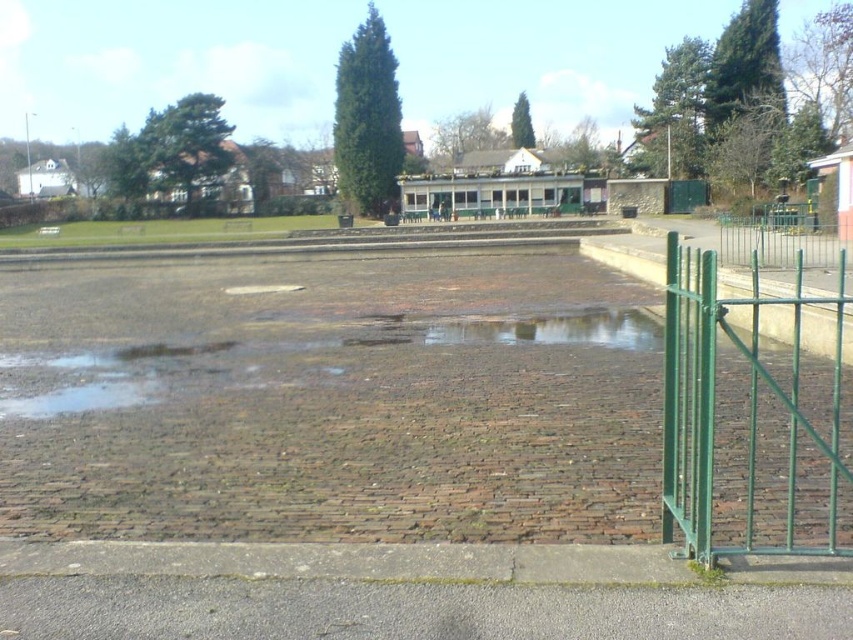
Consider the image. Does green painted metal gate at right have a larger size compared to green metal fence at right?

No, green painted metal gate at right is not bigger than green metal fence at right.

You are a GUI agent. You are given a task and a screenshot of the screen. Output one action in this format:
    pyautogui.click(x=<x>, y=<y>)
    Task: Click on the green painted metal gate at right
    This screenshot has height=640, width=853.
    Given the screenshot: What is the action you would take?
    pyautogui.click(x=747, y=412)

Between point (747, 497) and point (817, 243), which one is positioned in front?

Point (747, 497)

At what (x,y) coordinates should I click in order to perform the action: click on green painted metal gate at right. Please return your answer as a coordinate pair (x, y). This screenshot has width=853, height=640. Looking at the image, I should click on (747, 412).

Which is above, green painted metal gate at right or shiny brown puddle at center?

green painted metal gate at right is higher up.

Does point (693, 417) lie behind point (515, 330)?

No, it is not.

Does point (695, 404) come closer to viewer compared to point (627, 330)?

Yes, point (695, 404) is in front of point (627, 330).

Locate an element on the screen. Image resolution: width=853 pixels, height=640 pixels. green painted metal gate at right is located at coordinates (747, 412).

Can you confirm if shiny brown puddle at center is shorter than green metal fence at right?

Yes, shiny brown puddle at center is shorter than green metal fence at right.

Between point (614, 310) and point (735, 240), which one is positioned behind?

Positioned behind is point (735, 240).

Where is `shiny brown puddle at center`? This screenshot has height=640, width=853. shiny brown puddle at center is located at coordinates (555, 330).

Locate an element on the screen. shiny brown puddle at center is located at coordinates (555, 330).